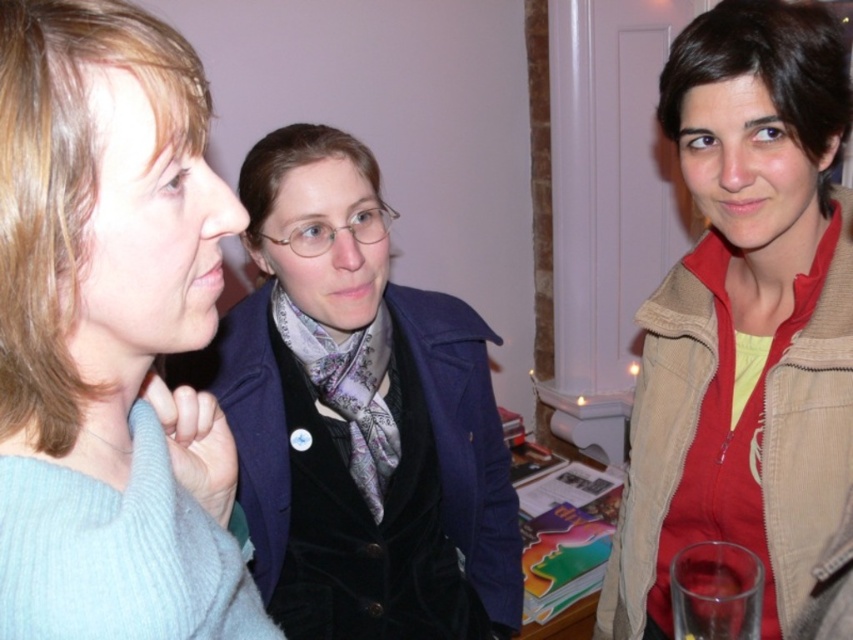
Question: Which point appears closest to the camera in this image?

Choices:
 (A) (219, 616)
 (B) (838, 284)

Answer: (A)

Question: Estimate the real-world distances between objects in this image. Which object is closer to the clear glass at lower right?

Choices:
 (A) velvet blue coat at center
 (B) tan corduroy jacket at right
 (C) light blue sweater at left

Answer: (B)

Question: From the image, what is the correct spatial relationship of tan corduroy jacket at right in relation to velvet blue coat at center?

Choices:
 (A) left
 (B) right

Answer: (B)

Question: Which object is closer to the camera taking this photo?

Choices:
 (A) tan corduroy jacket at right
 (B) velvet blue coat at center
 (C) clear glass at lower right
 (D) light blue sweater at left

Answer: (D)

Question: Can you confirm if light blue sweater at left is positioned below tan corduroy jacket at right?

Choices:
 (A) no
 (B) yes

Answer: (A)

Question: Does light blue sweater at left have a smaller size compared to clear glass at lower right?

Choices:
 (A) yes
 (B) no

Answer: (B)